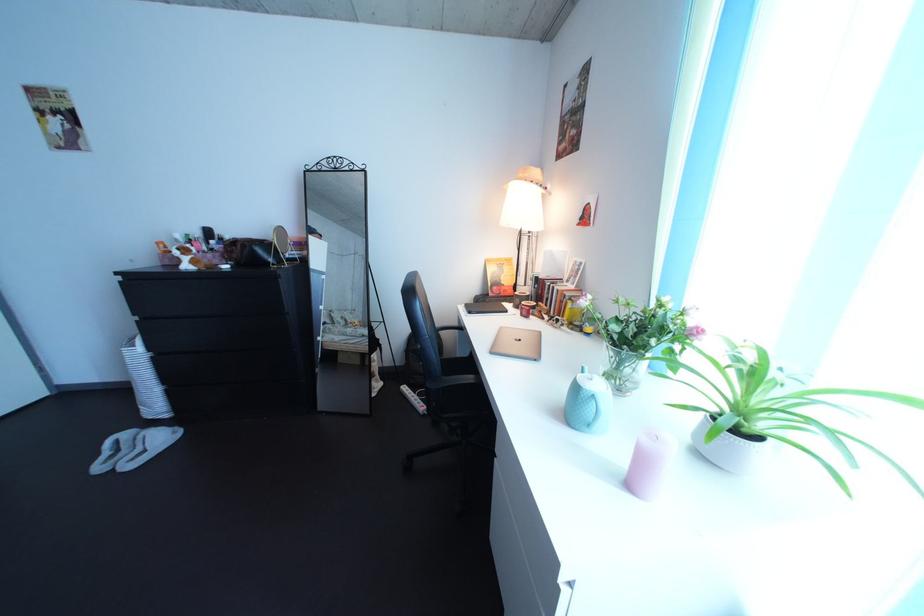
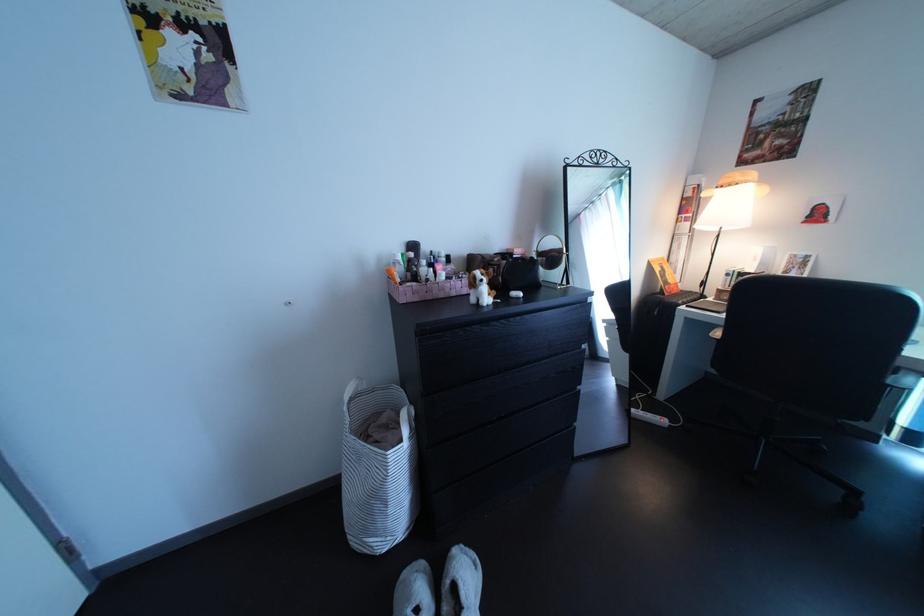
Question: The images are taken continuously from a first-person perspective. In which direction are you moving?

Choices:
 (A) Left
 (B) Right
 (C) Forward
 (D) Backward

Answer: (A)